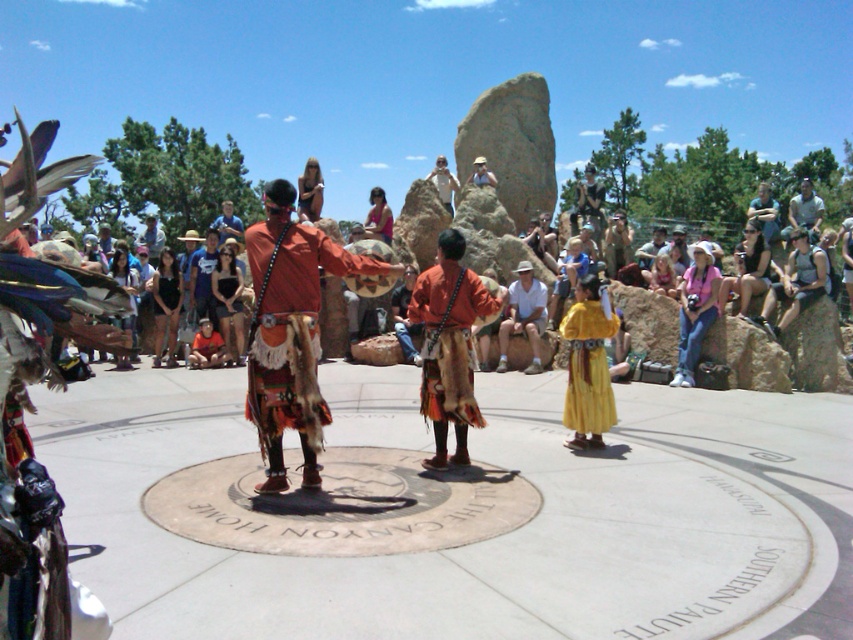
You are standing at the edge of the circular emblem and see the white cotton shirt at center and the light blue denim shirt at upper right. Which shirt is closer to you?

The white cotton shirt at center is closer to you because it is located below the light blue denim shirt at upper right, indicating it is positioned lower in the scene.